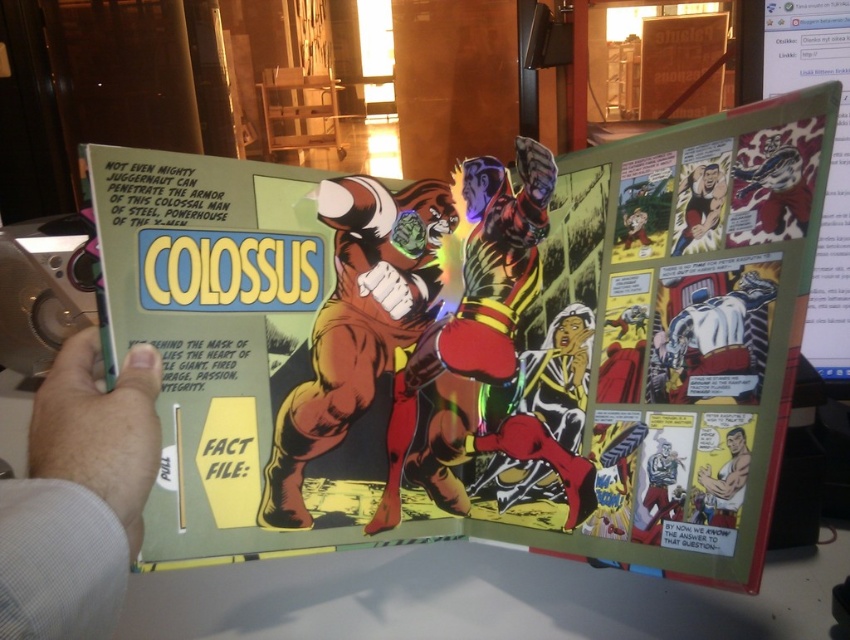
You are a graphic designer working on a layout for a new comic book cover. You need to ensure that the characters are clearly visible against the background. Given the scene described, which object should you adjust in size to make sure the smooth skin man at lower right and the blue fabric shirt at lower right are both prominent? Explain your reasoning.

The smooth skin man at lower right is larger in size compared to the blue fabric shirt at lower right. To ensure both are prominent, you should adjust the blue fabric shirt at lower right to be larger so it can compete with the size of the smooth skin man at lower right, making both elements stand out equally.

You are a comic book artist trying to determine the placement of a new character. The new character needs to be smaller than both the shiny metallic armor at center and the smooth skin figure at upper right. Where should you place the new character in relation to these two figures?

The new character should be placed in an area that is smaller than both the shiny metallic armor at center and the smooth skin figure at upper right. Since the shiny metallic armor at center is bigger than the smooth skin figure at upper right, the new character must be smaller than the smaller of the two, which is the smooth skin figure at upper right. However, the exact placement depends on the composition and available space in the comic panel.